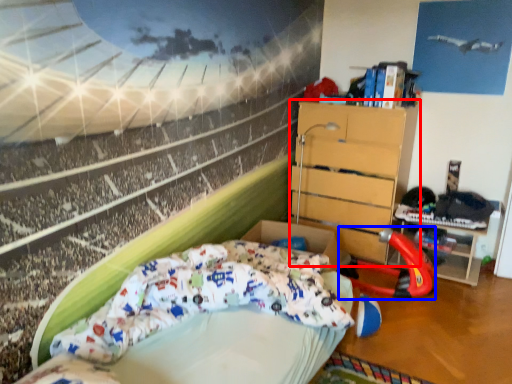
Question: Which object is closer to the camera taking this photo, chest of drawers (highlighted by a red box) or sport equipment (highlighted by a blue box)?

Choices:
 (A) chest of drawers
 (B) sport equipment

Answer: (B)